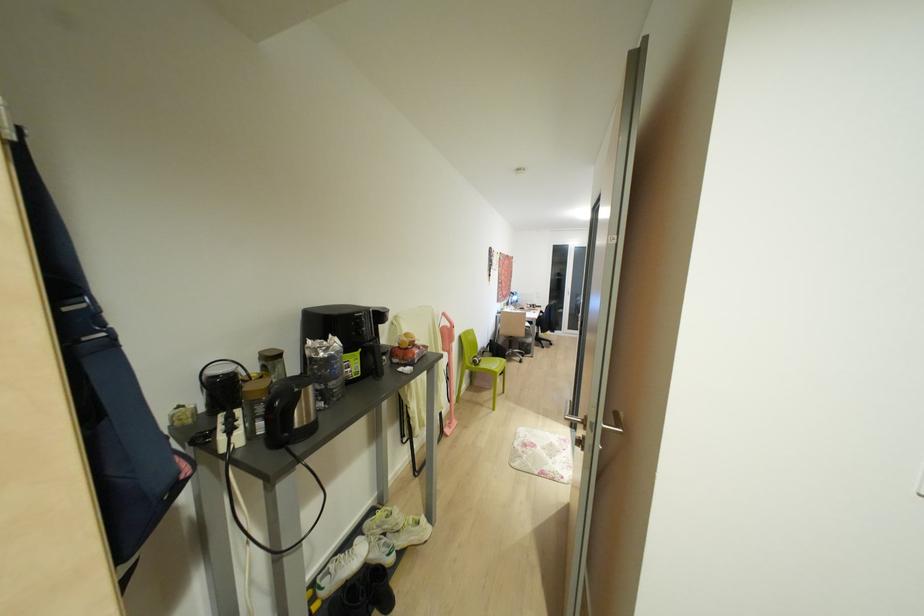
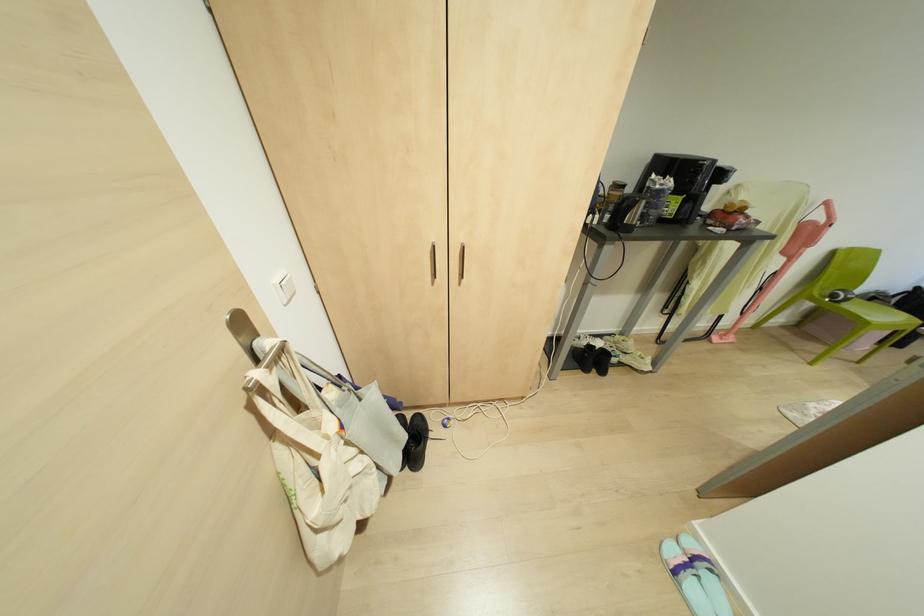
The point at (334, 342) is marked in the first image. Where is the corresponding point in the second image?

(670, 182)